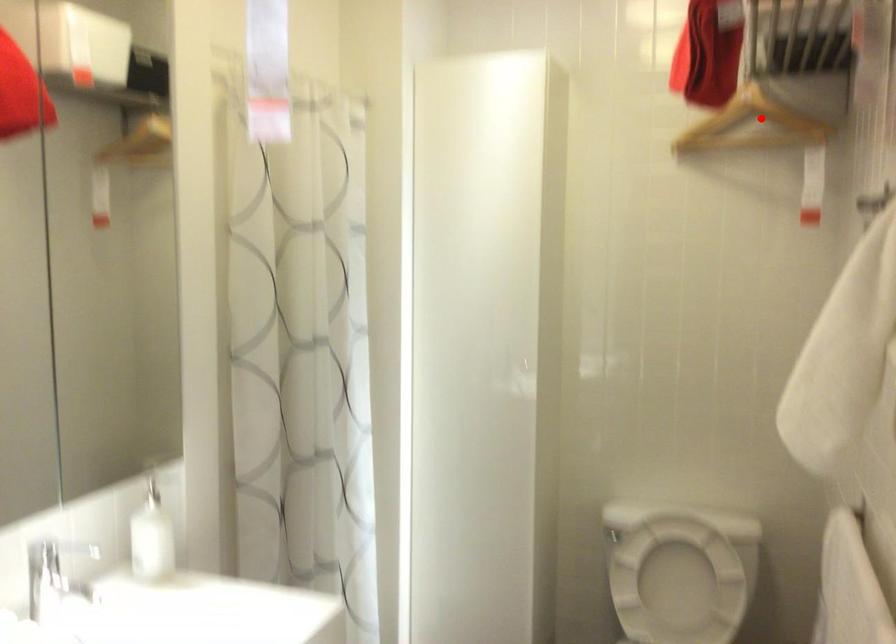
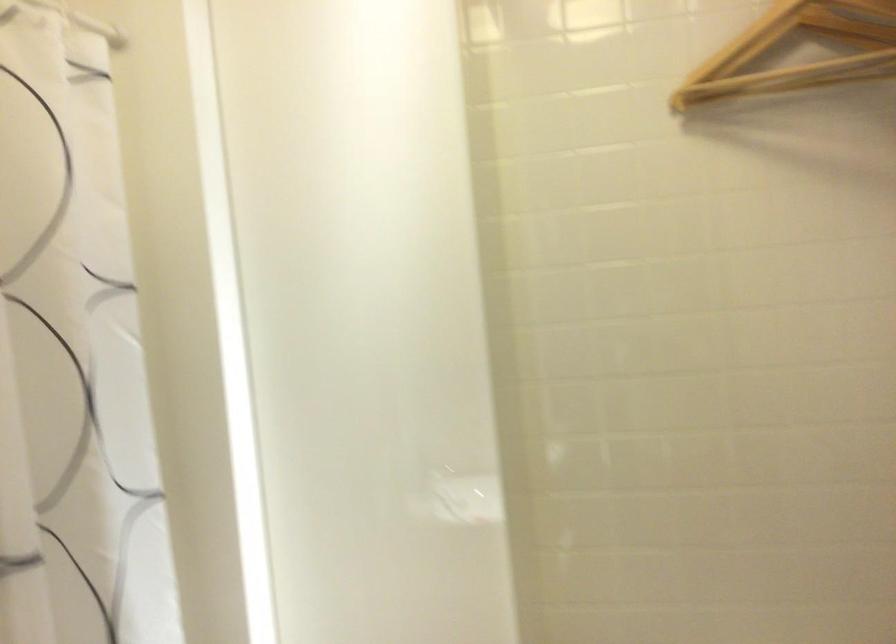
Locate, in the second image, the point that corresponds to the highlighted location in the first image.

(797, 51)